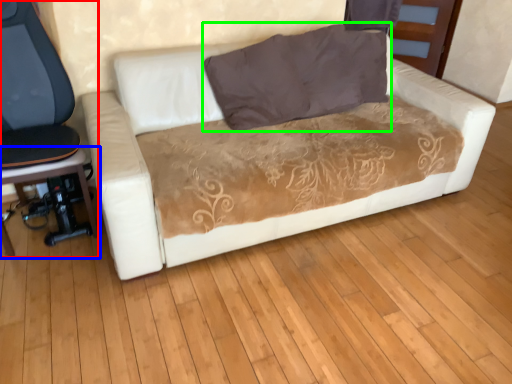
Question: Estimate the real-world distances between objects in this image. Which object is farther from chair (highlighted by a red box), music stool (highlighted by a blue box) or pillow (highlighted by a green box)?

Choices:
 (A) music stool
 (B) pillow

Answer: (B)